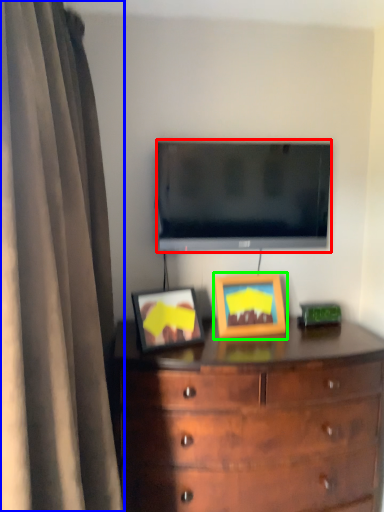
Question: Estimate the real-world distances between objects in this image. Which object is closer to television (highlighted by a red box), curtain (highlighted by a blue box) or picture frame (highlighted by a green box)?

Choices:
 (A) curtain
 (B) picture frame

Answer: (B)